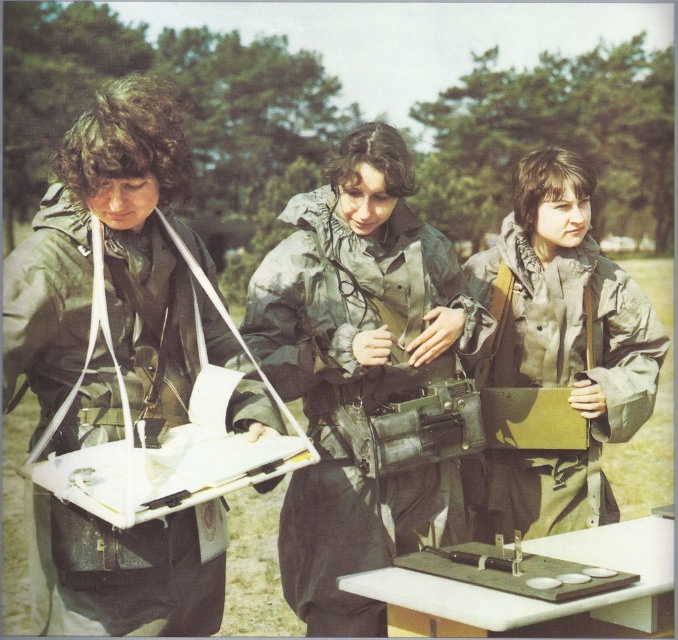
Question: Which object is farther from the camera taking this photo?

Choices:
 (A) white plastic picnic table at center
 (B) green matte jacket at center
 (C) metallic gray tray at center
 (D) matte green jacket at left

Answer: (B)

Question: Is green matte jacket at center behind matte green jacket at center?

Choices:
 (A) no
 (B) yes

Answer: (A)

Question: Which point is farther to the camera?

Choices:
 (A) green matte jacket at center
 (B) metallic gray tray at center
 (C) white plastic picnic table at center
 (D) matte green jacket at left

Answer: (A)

Question: Which object appears farthest from the camera in this image?

Choices:
 (A) matte green jacket at center
 (B) matte green jacket at left
 (C) metallic gray tray at center

Answer: (A)

Question: Does matte green jacket at left have a lesser width compared to white plastic picnic table at center?

Choices:
 (A) yes
 (B) no

Answer: (A)

Question: Can you confirm if matte green jacket at left is smaller than metallic gray tray at center?

Choices:
 (A) yes
 (B) no

Answer: (B)